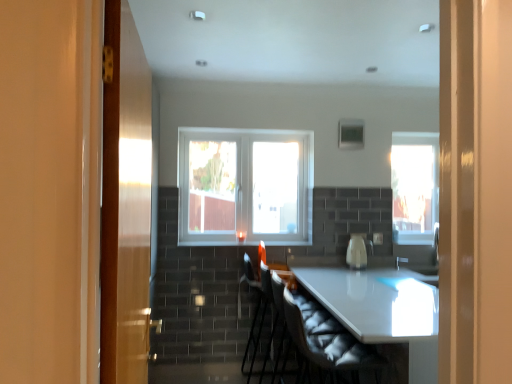
Question: Looking at their shapes, would you say velvet black armchair at center, marked as the 2th armchair in a back-to-front arrangement, is wider or thinner than white fabric swivel chair at center?

Choices:
 (A) wide
 (B) thin

Answer: (B)

Question: Would you say velvet black armchair at center, marked as the 2th armchair in a back-to-front arrangement, is to the left or to the right of white fabric swivel chair at center in the picture?

Choices:
 (A) right
 (B) left

Answer: (B)

Question: Estimate the real-world distances between objects in this image. Which object is closer to the white fabric armchair at center, marked as the second armchair in a front-to-back arrangement?

Choices:
 (A) transparent glass window at right, which is the 2th window from front to back
 (B) white fabric swivel chair at center
 (C) wooden door at left
 (D) white glossy kettle at center
 (E) velvet black armchair at center, marked as the 2th armchair in a back-to-front arrangement

Answer: (D)

Question: Estimate the real-world distances between objects in this image. Which object is farther from the velvet black armchair at center, the first armchair in the front-to-back sequence?

Choices:
 (A) white glossy kettle at center
 (B) white glossy table at center
 (C) white fabric swivel chair at center
 (D) clear glass window at center, positioned as the 1th window in left-to-right order
 (E) white fabric armchair at center, arranged as the first armchair when viewed from the back

Answer: (D)